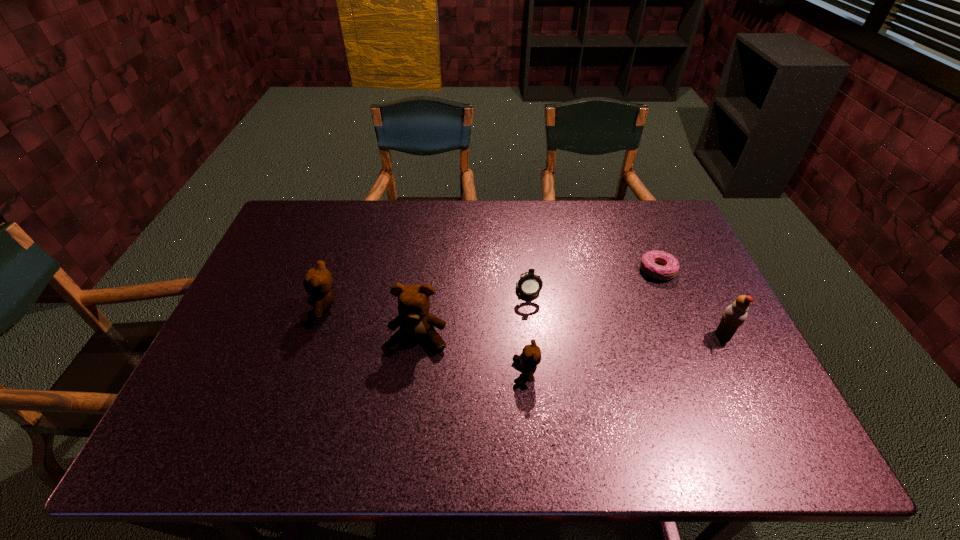
At what (x,y) coordinates should I click in order to perform the action: click on blank space located on the front-facing side of the second shortest teddy bear. Please return your answer as a coordinate pair (x, y). Looking at the image, I should click on (284, 308).

Find the location of a particular element. This screenshot has height=540, width=960. vacant space located 0.100m on the front-facing side of the second shortest teddy bear is located at coordinates (270, 308).

Identify the location of free spot located on the front-facing side of the second teddy bear from left to right. The width and height of the screenshot is (960, 540). (410, 395).

Image resolution: width=960 pixels, height=540 pixels. I want to click on vacant space located 0.170m on the front-facing side of the nearest teddy bear, so click(443, 373).

You are a GUI agent. You are given a task and a screenshot of the screen. Output one action in this format:
    pyautogui.click(x=<x>, y=<y>)
    Task: Click on the free location located on the front-facing side of the nearest teddy bear
    The image size is (960, 540).
    Given the screenshot: What is the action you would take?
    pyautogui.click(x=450, y=373)

The image size is (960, 540). In order to click on vacant space located 0.310m on the front-facing side of the nearest teddy bear in this screenshot , I will do `click(384, 373)`.

This screenshot has height=540, width=960. I want to click on free location located 0.260m at the front with a straw on the rightmost object, so click(x=613, y=335).

This screenshot has width=960, height=540. I want to click on vacant space situated at the front with a straw on the rightmost object, so click(x=644, y=335).

Find the location of a particular element. vacant region located 0.070m at the front with a straw on the rightmost object is located at coordinates (686, 335).

The image size is (960, 540). Find the location of `free space located 0.070m on the face of the compass`. free space located 0.070m on the face of the compass is located at coordinates (531, 320).